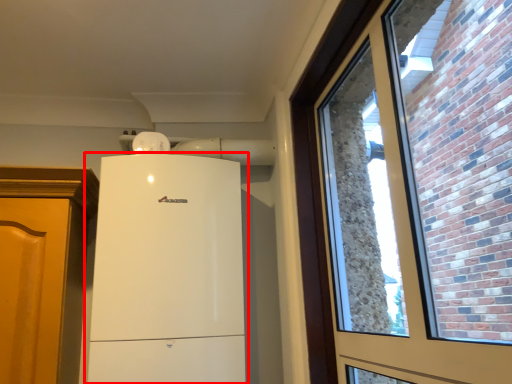
Question: Where is refrigerator (annotated by the red box) located in relation to window in the image?

Choices:
 (A) right
 (B) left

Answer: (B)